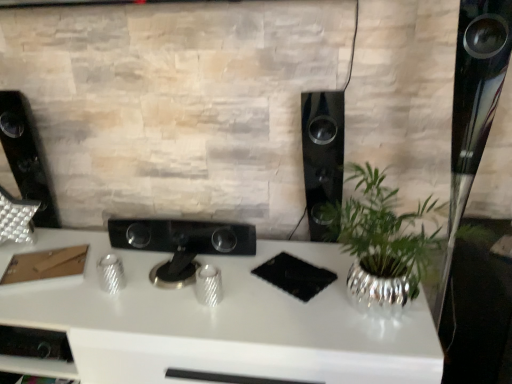
Question: From a real-world perspective, does white glossy desk at center sit lower than black glossy speaker at center-right, placed as the first speaker when sorted from right to left?

Choices:
 (A) no
 (B) yes

Answer: (B)

Question: Does white glossy desk at center have a lesser width compared to black glossy speaker at center-right, placed as the first speaker when sorted from right to left?

Choices:
 (A) no
 (B) yes

Answer: (A)

Question: Is white glossy desk at center wider than black glossy speaker at center-right, placed as the first speaker when sorted from right to left?

Choices:
 (A) no
 (B) yes

Answer: (B)

Question: Could you tell me if white glossy desk at center is facing black glossy speaker at center-right, placed as the first speaker when sorted from right to left?

Choices:
 (A) yes
 (B) no

Answer: (B)

Question: From the image's perspective, is white glossy desk at center below black glossy speaker at center-right, placed as the first speaker when sorted from right to left?

Choices:
 (A) no
 (B) yes

Answer: (B)

Question: Does white glossy desk at center come in front of black glossy speaker at center-right, the second speaker positioned from the left?

Choices:
 (A) no
 (B) yes

Answer: (B)

Question: Does black glossy speaker at left, which is the 1th speaker in left-to-right order, turn towards black glossy speaker at center-right, placed as the first speaker when sorted from right to left?

Choices:
 (A) no
 (B) yes

Answer: (A)

Question: Is black glossy speaker at left, which ranks as the 2th speaker in right-to-left order, completely or partially outside of black glossy speaker at center-right, the second speaker positioned from the left?

Choices:
 (A) no
 (B) yes

Answer: (B)

Question: From the image's perspective, is black glossy speaker at left, which is the 1th speaker in left-to-right order, on black glossy speaker at center-right, the second speaker positioned from the left?

Choices:
 (A) yes
 (B) no

Answer: (A)

Question: Is black glossy speaker at left, which is the 1th speaker in left-to-right order, oriented away from black glossy speaker at center-right, placed as the first speaker when sorted from right to left?

Choices:
 (A) no
 (B) yes

Answer: (A)

Question: Is black glossy speaker at left, which is the 1th speaker in left-to-right order, to the left of black glossy speaker at center-right, the second speaker positioned from the left, from the viewer's perspective?

Choices:
 (A) yes
 (B) no

Answer: (A)

Question: Can you confirm if black glossy speaker at left, which ranks as the 2th speaker in right-to-left order, is thinner than black glossy speaker at center-right, the second speaker positioned from the left?

Choices:
 (A) no
 (B) yes

Answer: (B)

Question: Does white glossy desk at center touch black glossy controller at center?

Choices:
 (A) yes
 (B) no

Answer: (B)